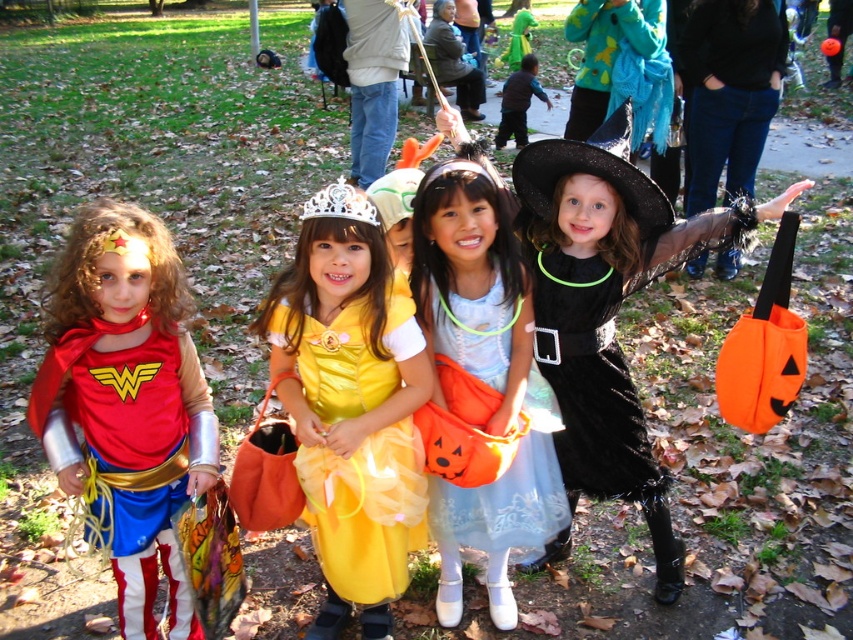
Question: Which is farther from the matte red cape at left?

Choices:
 (A) light blue satin dress at center
 (B) yellow satin dress at center

Answer: (A)

Question: Does light blue satin dress at center appear over black matte witch hat at center?

Choices:
 (A) no
 (B) yes

Answer: (A)

Question: Which object is positioned farthest from the black matte witch hat at center?

Choices:
 (A) matte red cape at left
 (B) yellow satin dress at center

Answer: (A)

Question: Can you confirm if matte red cape at left is positioned to the right of yellow satin dress at center?

Choices:
 (A) yes
 (B) no

Answer: (B)

Question: Which of these objects is positioned closest to the light blue satin dress at center?

Choices:
 (A) yellow satin dress at center
 (B) matte red cape at left

Answer: (A)

Question: In this image, where is yellow satin dress at center located relative to black matte witch hat at center?

Choices:
 (A) right
 (B) left

Answer: (B)